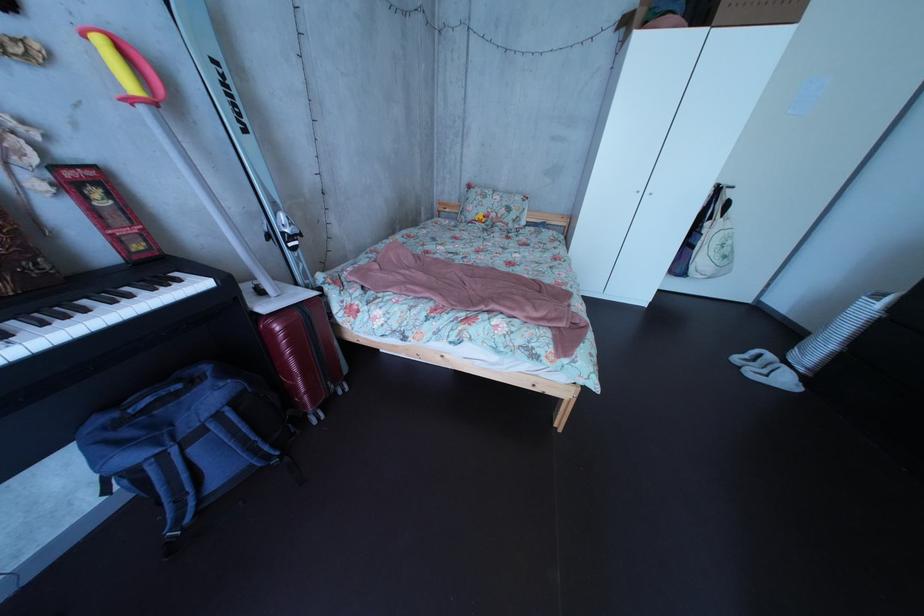
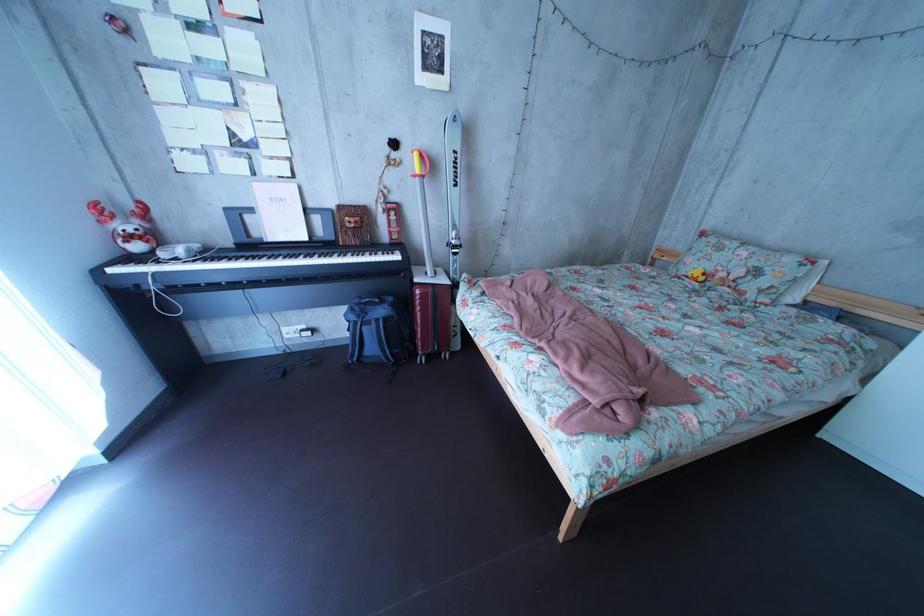
In the second image, find the point that corresponds to point 225,407 in the first image.

(395, 320)